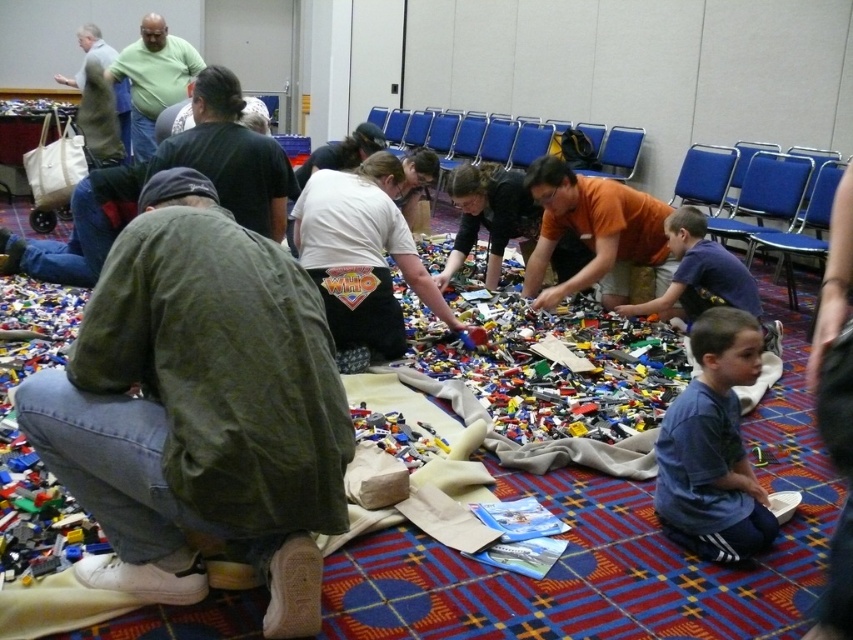
Question: Is green cotton shirt at lower left thinner than blue cotton shirt at lower right?

Choices:
 (A) yes
 (B) no

Answer: (B)

Question: Which object is positioned closest to the dark blue t-shirt at center?

Choices:
 (A) gray fabric jacket at upper left
 (B) blue fabric chair at upper right
 (C) blue cotton shirt at lower right
 (D) orange matte shirt at center

Answer: (D)

Question: Based on their relative distances, which object is nearer to the green cotton shirt at lower left?

Choices:
 (A) blue fabric chair at upper right
 (B) light green t-shirt at upper left

Answer: (A)

Question: Can you confirm if light green t-shirt at upper left is positioned above blue fabric chair at right?

Choices:
 (A) no
 (B) yes

Answer: (B)

Question: Does green cotton shirt at lower left appear under orange matte shirt at center?

Choices:
 (A) no
 (B) yes

Answer: (B)

Question: Which is farther from the dark blue t-shirt at center?

Choices:
 (A) blue cotton shirt at lower right
 (B) light green t-shirt at upper left
 (C) dark green jacket at left

Answer: (B)